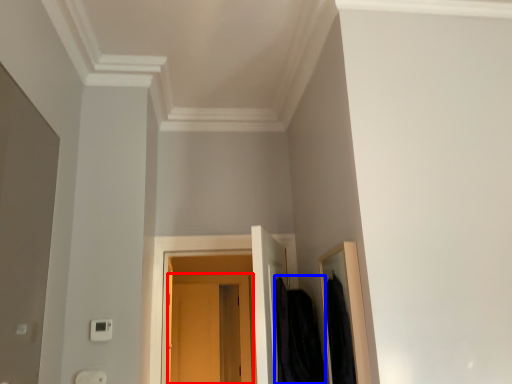
Question: Which of the following is the farthest to the observer, door (highlighted by a red box) or clothing (highlighted by a blue box)?

Choices:
 (A) door
 (B) clothing

Answer: (A)